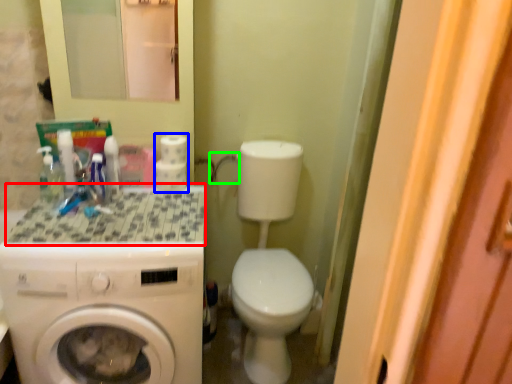
Question: Considering the real-world distances, which object is closest to counter top (highlighted by a red box)? toilet paper (highlighted by a blue box) or faucet (highlighted by a green box).

Choices:
 (A) toilet paper
 (B) faucet

Answer: (A)